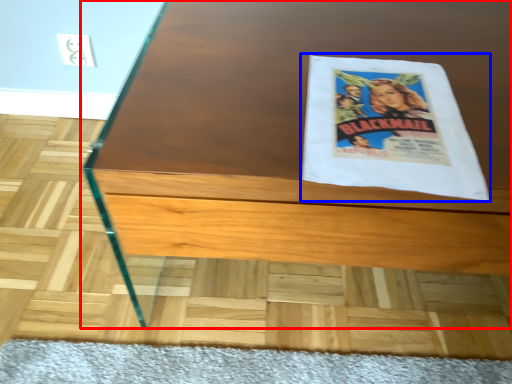
Question: Which object appears farthest to the camera in this image, table (highlighted by a red box) or flyer (highlighted by a blue box)?

Choices:
 (A) table
 (B) flyer

Answer: (B)